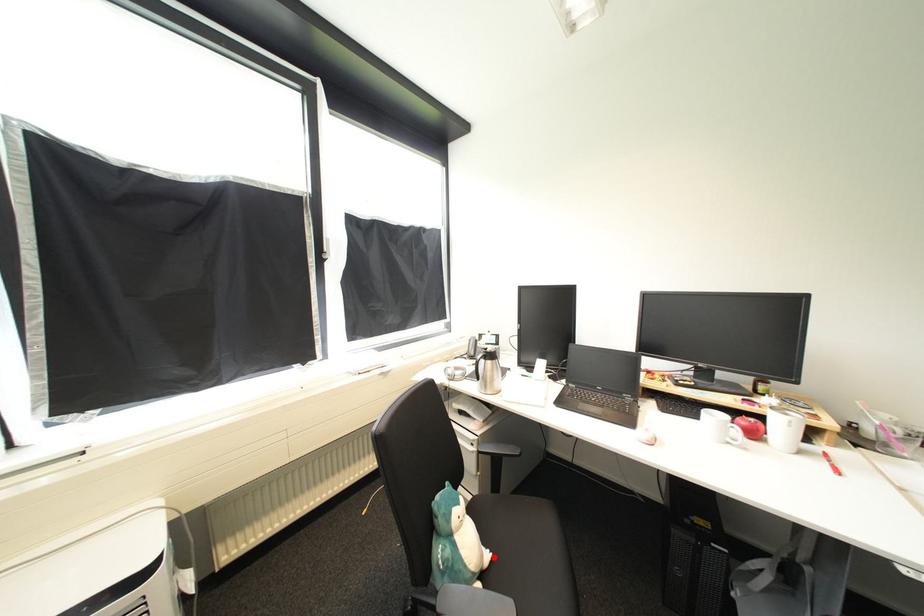
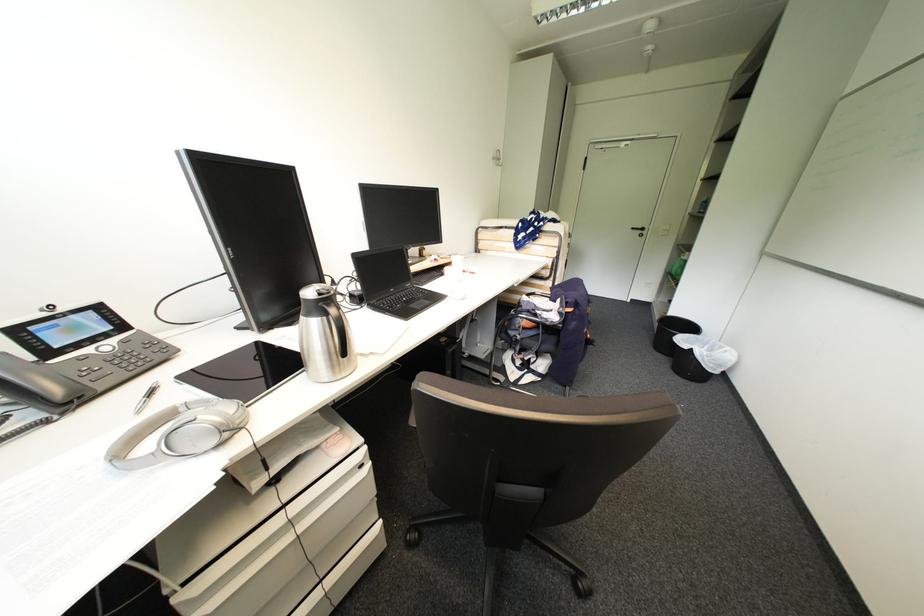
Question: I am providing you with two images of the same scene from different viewpoints. A red point is marked on the first image. At the location where the point appears in image 1, is it still visible in image 2?

Choices:
 (A) Yes
 (B) No

Answer: (B)